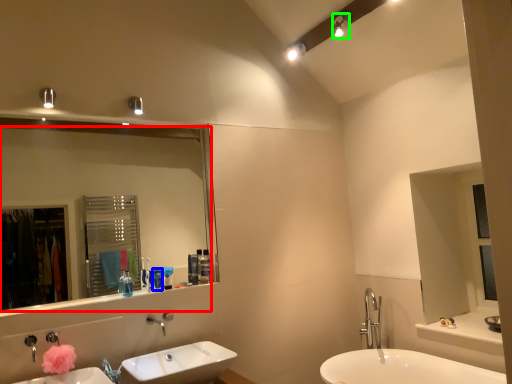
Question: Which object is the closest to the mirror (highlighted by a red box)? Choose among these: toiletry (highlighted by a blue box) or light fixture (highlighted by a green box).

Choices:
 (A) toiletry
 (B) light fixture

Answer: (A)